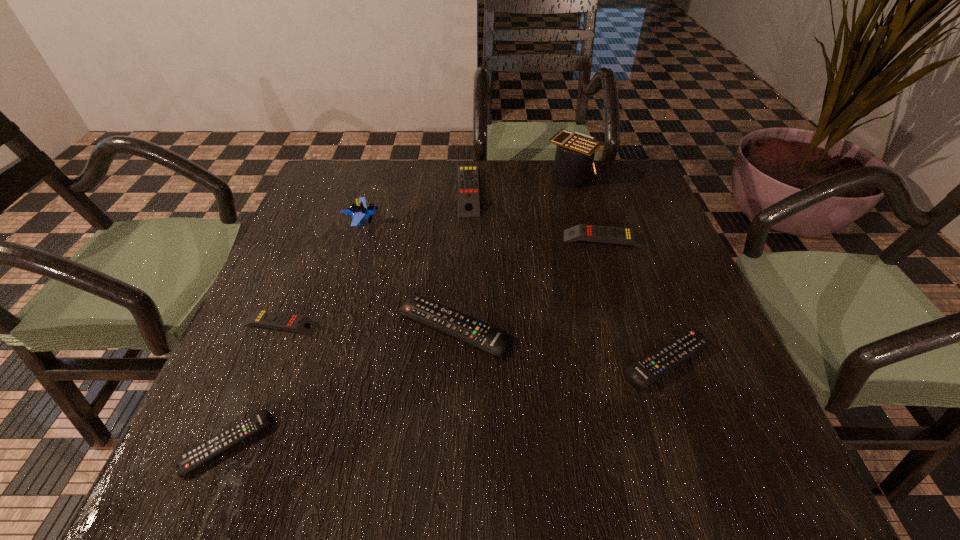
In order to click on calculator in this screenshot , I will do `click(574, 158)`.

In order to click on blue Lego in this screenshot , I will do `click(359, 211)`.

Find the location of a particular element. The height and width of the screenshot is (540, 960). the seventh shortest object is located at coordinates [359, 211].

Locate an element on the screen. the tallest remote control is located at coordinates (468, 184).

Where is `the biggest yellow remote control`? Image resolution: width=960 pixels, height=540 pixels. the biggest yellow remote control is located at coordinates (468, 184).

Locate an element on the screen. The width and height of the screenshot is (960, 540). the second nearest yellow remote control is located at coordinates (617, 235).

Find the location of a particular element. This screenshot has height=540, width=960. the second farthest remote control is located at coordinates (617, 235).

Locate an element on the screen. This screenshot has height=540, width=960. the second black remote control from left to right is located at coordinates [486, 337].

The height and width of the screenshot is (540, 960). What are the coordinates of `the rightmost black remote control` in the screenshot? It's located at (642, 373).

At what (x,y) coordinates should I click in order to perform the action: click on the leftmost yellow remote control. Please return your answer as a coordinate pair (x, y). Image resolution: width=960 pixels, height=540 pixels. Looking at the image, I should click on (263, 318).